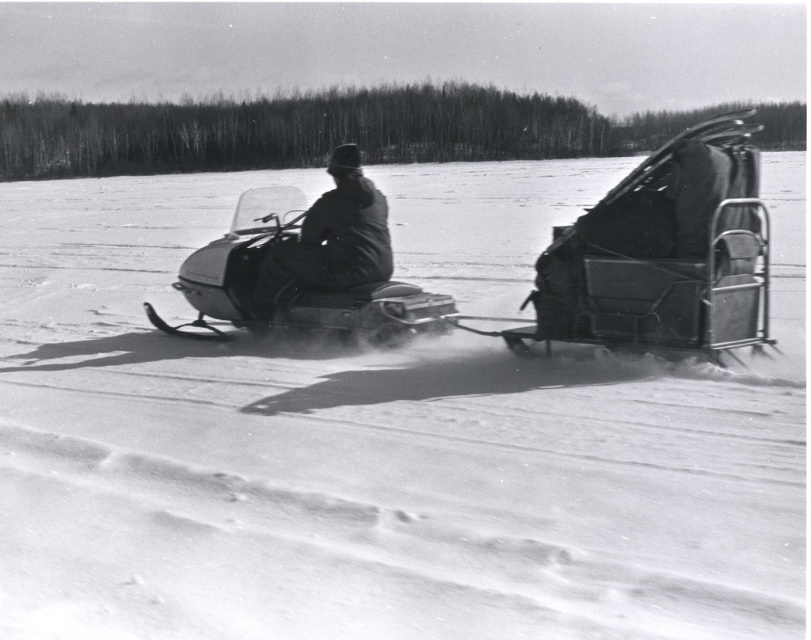
Question: Among these objects, which one is nearest to the camera?

Choices:
 (A) dark fabric jacket at center
 (B) metallic silver snowmobile at center-left

Answer: (A)

Question: Does metallic silver snowmobile at center-left appear over dark fabric jacket at center?

Choices:
 (A) yes
 (B) no

Answer: (B)

Question: Is metallic silver snowmobile at center-left to the right of dark fabric jacket at center from the viewer's perspective?

Choices:
 (A) yes
 (B) no

Answer: (B)

Question: Which of the following is the farthest from the observer?

Choices:
 (A) dark fabric jacket at center
 (B) metallic silver snowmobile at center-left

Answer: (B)

Question: Where is metallic silver snowmobile at center-left located in relation to dark fabric jacket at center in the image?

Choices:
 (A) right
 (B) left

Answer: (B)